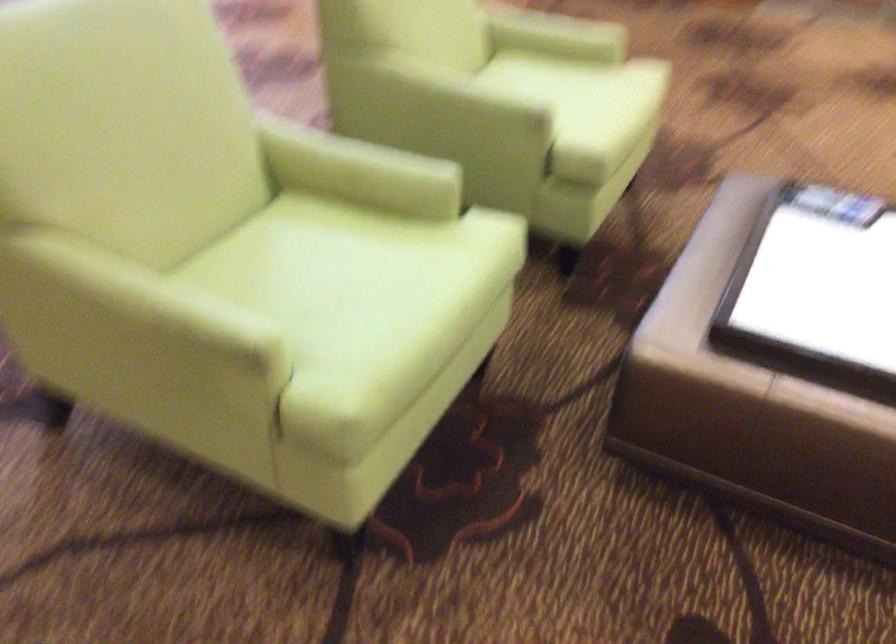
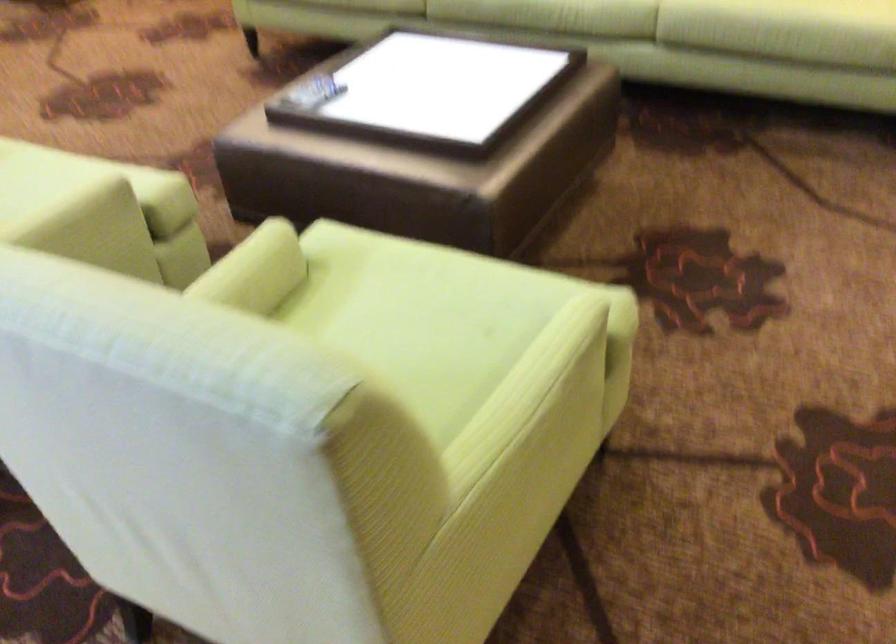
Question: I am providing you with two images of the same scene from different viewpoints. After the viewpoint changes to image2, which objects are now occluded?

Choices:
 (A) chair sitting surface
 (B) sofa sitting surface
 (C) light green armrest
 (D) none of these

Answer: (D)